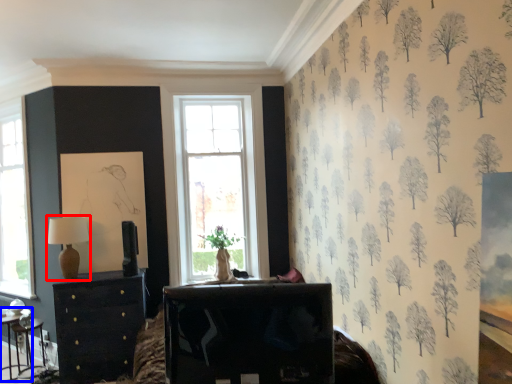
Question: Which of the following is the closest to the observer, table lamp (highlighted by a red box) or table (highlighted by a blue box)?

Choices:
 (A) table lamp
 (B) table

Answer: (A)